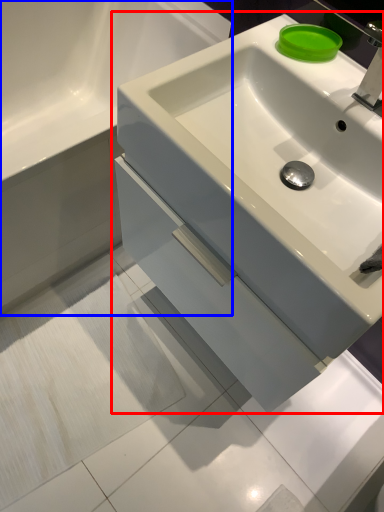
Question: Which object is further to the camera taking this photo, sink (highlighted by a red box) or bathroom cabinet (highlighted by a blue box)?

Choices:
 (A) sink
 (B) bathroom cabinet

Answer: (B)